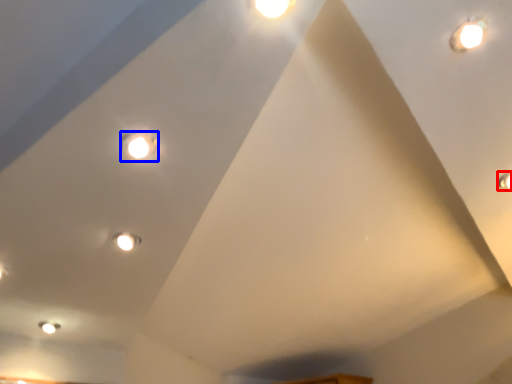
Question: Which object appears closest to the camera in this image, light (highlighted by a red box) or light (highlighted by a blue box)?

Choices:
 (A) light
 (B) light

Answer: (B)